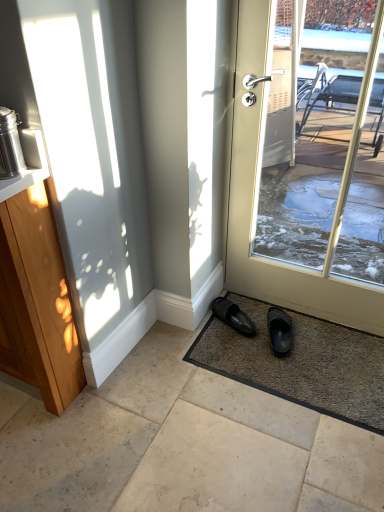
Describe the element at coordinates (10, 145) in the screenshot. I see `stainless steel thermos at left` at that location.

What do you see at coordinates (301, 364) in the screenshot? This screenshot has height=512, width=384. I see `brown textured mat at lower center` at bounding box center [301, 364].

What do you see at coordinates (233, 316) in the screenshot?
I see `black rubber slipper at lower center, marked as the first footwear in a left-to-right arrangement` at bounding box center [233, 316].

Image resolution: width=384 pixels, height=512 pixels. What do you see at coordinates (256, 204) in the screenshot?
I see `matte white door at center` at bounding box center [256, 204].

What is the approximate width of smooth beige tiles at center?

smooth beige tiles at center is 4.92 feet wide.

Describe the element at coordinates (180, 444) in the screenshot. I see `smooth beige tiles at center` at that location.

Where is `stainless steel thermos at left`? stainless steel thermos at left is located at coordinates (10, 145).

From the image's perspective, is wooden cabinet at left above stainless steel thermos at left?

Actually, wooden cabinet at left appears below stainless steel thermos at left in the image.

Looking at this image, can you confirm if wooden cabinet at left is smaller than stainless steel thermos at left?

No.

Is wooden cabinet at left completely or partially outside of stainless steel thermos at left?

Yes.

Based on the photo, from a real-world perspective, is wooden cabinet at left below stainless steel thermos at left?

Yes, from a real-world perspective, wooden cabinet at left is below stainless steel thermos at left.

How many degrees apart are the facing directions of black rubber slipper at lower right, which appears as the second footwear when viewed from the left, and brown textured mat at lower center?

166 degrees separate the facing orientations of black rubber slipper at lower right, which appears as the second footwear when viewed from the left, and brown textured mat at lower center.

Does point (276, 312) come closer to viewer compared to point (335, 346)?

No.

Considering the sizes of objects black rubber slipper at lower right, which appears as the second footwear when viewed from the left, and brown textured mat at lower center in the image provided, who is wider, black rubber slipper at lower right, which appears as the second footwear when viewed from the left, or brown textured mat at lower center?

With larger width is brown textured mat at lower center.

How distant is smooth beige tiles at center from brown textured mat at lower center?

smooth beige tiles at center is 10.64 inches from brown textured mat at lower center.

Is smooth beige tiles at center directly adjacent to brown textured mat at lower center?

No, smooth beige tiles at center is not in contact with brown textured mat at lower center.

From the image's perspective, who appears lower, smooth beige tiles at center or brown textured mat at lower center?

smooth beige tiles at center, from the image's perspective.

Does smooth beige tiles at center have a greater width compared to brown textured mat at lower center?

Indeed, smooth beige tiles at center has a greater width compared to brown textured mat at lower center.

Would you say black rubber slipper at lower center, marked as the first footwear in a left-to-right arrangement, is inside or outside wooden cabinet at left?

The correct answer is: outside.

How different are the orientations of black rubber slipper at lower center, the 2th footwear when ordered from right to left, and wooden cabinet at left in degrees?

There is a 126-degree angle between the facing directions of black rubber slipper at lower center, the 2th footwear when ordered from right to left, and wooden cabinet at left.

At what (x,y) coordinates should I click in order to perform the action: click on window above the black rubber slipper at lower center, the 2th footwear when ordered from right to left (from the image's perspective). Please return your answer as a coordinate pair (x, y). Image resolution: width=384 pixels, height=512 pixels. Looking at the image, I should click on (92, 153).

Based on the photo, considering their positions, is black rubber slipper at lower center, marked as the first footwear in a left-to-right arrangement, located in front of or behind wooden cabinet at left?

In the image, black rubber slipper at lower center, marked as the first footwear in a left-to-right arrangement, appears behind wooden cabinet at left.

Which is in front, stainless steel thermos at left or matte white door at center?

stainless steel thermos at left is closer to the camera.

Which point is more distant from viewer, (6, 154) or (256, 28)?

The point (256, 28) is more distant.

Between stainless steel thermos at left and matte white door at center, which one appears on the left side from the viewer's perspective?

Positioned to the left is stainless steel thermos at left.

This screenshot has height=512, width=384. Find the location of `appliance that is above the matte white door at center (from the image's perspective)`. appliance that is above the matte white door at center (from the image's perspective) is located at coordinates (10, 145).

From a real-world perspective, who is located lower, smooth beige tiles at center or black rubber slipper at lower right, which appears as the second footwear when viewed from the left?

From a 3D spatial view, smooth beige tiles at center is below.

Would you say smooth beige tiles at center is inside or outside black rubber slipper at lower right, which is the 1th footwear in right-to-left order?

smooth beige tiles at center is not enclosed by black rubber slipper at lower right, which is the 1th footwear in right-to-left order.

Which object is further away from the camera, smooth beige tiles at center or black rubber slipper at lower right, which is the 1th footwear in right-to-left order?

black rubber slipper at lower right, which is the 1th footwear in right-to-left order, is further from the camera.

Would you consider smooth beige tiles at center to be distant from black rubber slipper at lower right, which is the 1th footwear in right-to-left order?

No, smooth beige tiles at center is not far from black rubber slipper at lower right, which is the 1th footwear in right-to-left order.

Which is farther, (237, 271) or (367, 387)?

Point (237, 271)

Based on the photo, is matte white door at center not inside brown textured mat at lower center?

matte white door at center is positioned outside brown textured mat at lower center.

From a real-world perspective, is matte white door at center above or below brown textured mat at lower center?

Clearly, from a real-world perspective, matte white door at center is above brown textured mat at lower center.

Is matte white door at center aimed at brown textured mat at lower center?

Yes.

Find the location of a particular element. This screenshot has height=512, width=384. appliance located in front of the wooden cabinet at left is located at coordinates (10, 145).

Starting from the brown textured mat at lower center, which footwear is the 1st one behind? Please provide its 2D coordinates.

[(279, 331)]

Which object lies nearer to the anchor point matte white door at center, black rubber slipper at lower right, which is the 1th footwear in right-to-left order, or brown textured mat at lower center?

brown textured mat at lower center.

Based on their spatial positions, is matte white door at center or wooden cabinet at left further from brown textured mat at lower center?

Based on the image, wooden cabinet at left appears to be further to brown textured mat at lower center.

Considering their positions, is brown textured mat at lower center positioned further to wooden cabinet at left than black rubber slipper at lower center, marked as the first footwear in a left-to-right arrangement?

Among the two, black rubber slipper at lower center, marked as the first footwear in a left-to-right arrangement, is located further to wooden cabinet at left.

When comparing their distances from smooth beige tiles at center, does black rubber slipper at lower right, which is the 1th footwear in right-to-left order, or wooden cabinet at left seem further?

wooden cabinet at left.

Estimate the real-world distances between objects in this image. Which object is closer to black rubber slipper at lower right, which is the 1th footwear in right-to-left order, wooden cabinet at left or black rubber slipper at lower center, marked as the first footwear in a left-to-right arrangement?

black rubber slipper at lower center, marked as the first footwear in a left-to-right arrangement, lies closer to black rubber slipper at lower right, which is the 1th footwear in right-to-left order, than the other object.

When comparing their distances from smooth beige tiles at center, does black rubber slipper at lower center, marked as the first footwear in a left-to-right arrangement, or matte white door at center seem closer?

black rubber slipper at lower center, marked as the first footwear in a left-to-right arrangement.

From the picture: Looking at the image, which one is located closer to matte white door at center, stainless steel thermos at left or wooden cabinet at left?

wooden cabinet at left.

Looking at this image, looking at the image, which one is located further to black rubber slipper at lower center, marked as the first footwear in a left-to-right arrangement, black rubber slipper at lower right, which appears as the second footwear when viewed from the left, or wooden cabinet at left?

wooden cabinet at left lies further to black rubber slipper at lower center, marked as the first footwear in a left-to-right arrangement, than the other object.

Image resolution: width=384 pixels, height=512 pixels. What are the coordinates of `door located between smooth beige tiles at center and black rubber slipper at lower center, the 2th footwear when ordered from right to left, in the depth direction` in the screenshot? It's located at (256, 204).

I want to click on mat situated between wooden cabinet at left and matte white door at center from left to right, so click(x=301, y=364).

Find the location of a particular element. This screenshot has height=512, width=384. window between stainless steel thermos at left and smooth beige tiles at center from top to bottom is located at coordinates (92, 153).

Where is `concrete between wooden cabinet at left and matte white door at center`? The width and height of the screenshot is (384, 512). concrete between wooden cabinet at left and matte white door at center is located at coordinates (180, 444).